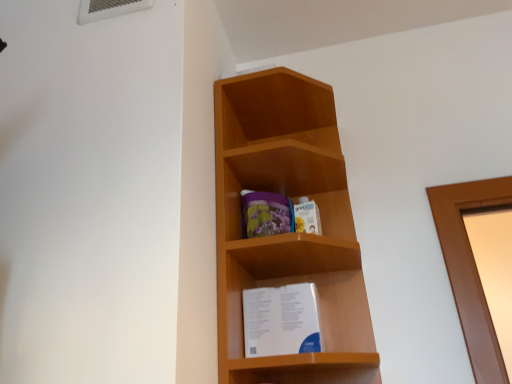
Image resolution: width=512 pixels, height=384 pixels. What do you see at coordinates (281, 320) in the screenshot?
I see `white paper at center` at bounding box center [281, 320].

The height and width of the screenshot is (384, 512). In order to click on white paper at center in this screenshot , I will do `click(281, 320)`.

Measure the distance between point (256, 155) and camera.

Point (256, 155) and camera are 39.33 inches apart.

This screenshot has width=512, height=384. Describe the element at coordinates (288, 234) in the screenshot. I see `light brown wood at center` at that location.

Locate an element on the screen. light brown wood at center is located at coordinates (288, 234).

Where is `white paper at center`? Image resolution: width=512 pixels, height=384 pixels. white paper at center is located at coordinates 281,320.

Considering the relative positions of light brown wood at center and white paper at center in the image provided, is light brown wood at center to the right of white paper at center from the viewer's perspective?

No.

Considering their positions, is light brown wood at center located in front of or behind white paper at center?

light brown wood at center is positioned closer to the viewer than white paper at center.

Which is less distant, (290, 162) or (302, 315)?

The point (302, 315) is more forward.

From the image's perspective, is light brown wood at center above white paper at center?

Correct, light brown wood at center appears higher than white paper at center in the image.

From a real-world perspective, is light brown wood at center above or below white paper at center?

light brown wood at center is above white paper at center.

Which of these two, light brown wood at center or white paper at center, is wider?

light brown wood at center.

Considering the relative sizes of light brown wood at center and white paper at center in the image provided, is light brown wood at center shorter than white paper at center?

Incorrect, the height of light brown wood at center does not fall short of that of white paper at center.

Which of these two, light brown wood at center or white paper at center, is smaller?

white paper at center.

Is light brown wood at center surrounding white paper at center?

Yes.

Can you see light brown wood at center touching white paper at center?

No.

Does light brown wood at center turn towards white paper at center?

Yes, light brown wood at center is aimed at white paper at center.

The width and height of the screenshot is (512, 384). In order to click on paperback book below the light brown wood at center (from a real-world perspective) in this screenshot , I will do `click(281, 320)`.

Does white paper at center appear on the right side of light brown wood at center?

Yes, white paper at center is to the right of light brown wood at center.

In the image, is white paper at center positioned in front of or behind light brown wood at center?

In the image, white paper at center appears behind light brown wood at center.

Is point (251, 299) closer or farther from the camera than point (238, 307)?

Point (251, 299) appears to be farther away from the viewer than point (238, 307).

From the image's perspective, is white paper at center above light brown wood at center?

Actually, white paper at center appears below light brown wood at center in the image.

From a real-world perspective, is white paper at center positioned under light brown wood at center based on gravity?

Indeed, from a real-world perspective, white paper at center is positioned beneath light brown wood at center.

In the scene shown: Which object is wider, white paper at center or light brown wood at center?

light brown wood at center is wider.

Considering the sizes of objects white paper at center and light brown wood at center in the image provided, who is taller, white paper at center or light brown wood at center?

light brown wood at center.

Does white paper at center have a larger size compared to light brown wood at center?

No, white paper at center is not bigger than light brown wood at center.

Is white paper at center positioned beyond the bounds of light brown wood at center?

Actually, white paper at center is at least partially inside light brown wood at center.

Consider the image. Are white paper at center and light brown wood at center making contact?

No.

Is white paper at center aimed at light brown wood at center?

Yes, white paper at center is facing light brown wood at center.

How different are the orientations of white paper at center and light brown wood at center in degrees?

white paper at center and light brown wood at center are facing 3.71 degrees away from each other.

In the scene shown: How distant is white paper at center from light brown wood at center?

A distance of 20.72 centimeters exists between white paper at center and light brown wood at center.

Find the location of `paperback book below the light brown wood at center (from the image's perspective)`. paperback book below the light brown wood at center (from the image's perspective) is located at coordinates (281, 320).

This screenshot has width=512, height=384. Find the location of `shelf above the white paper at center (from the image's perspective)`. shelf above the white paper at center (from the image's perspective) is located at coordinates (288, 234).

Identify the location of paperback book located underneath the light brown wood at center (from a real-world perspective). Image resolution: width=512 pixels, height=384 pixels. (281, 320).